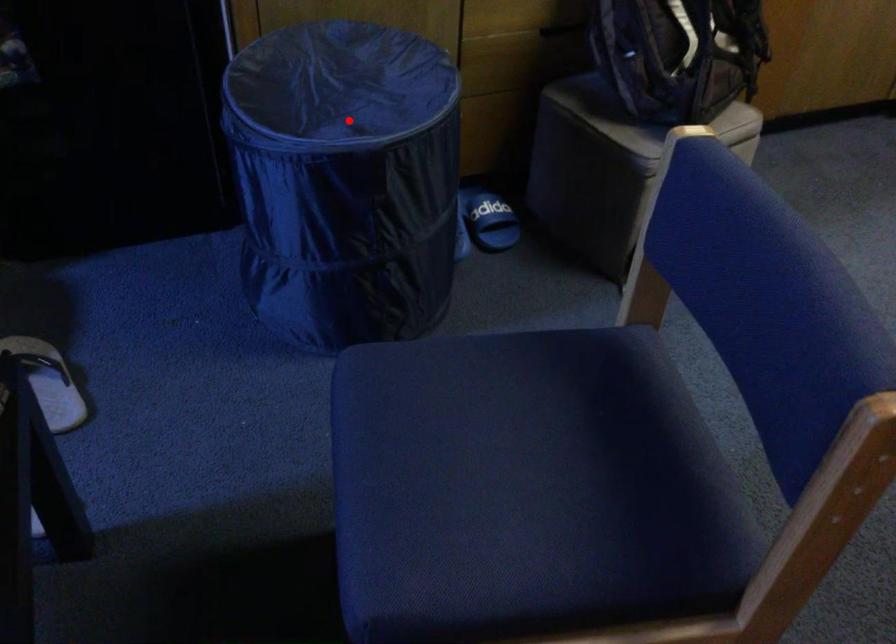
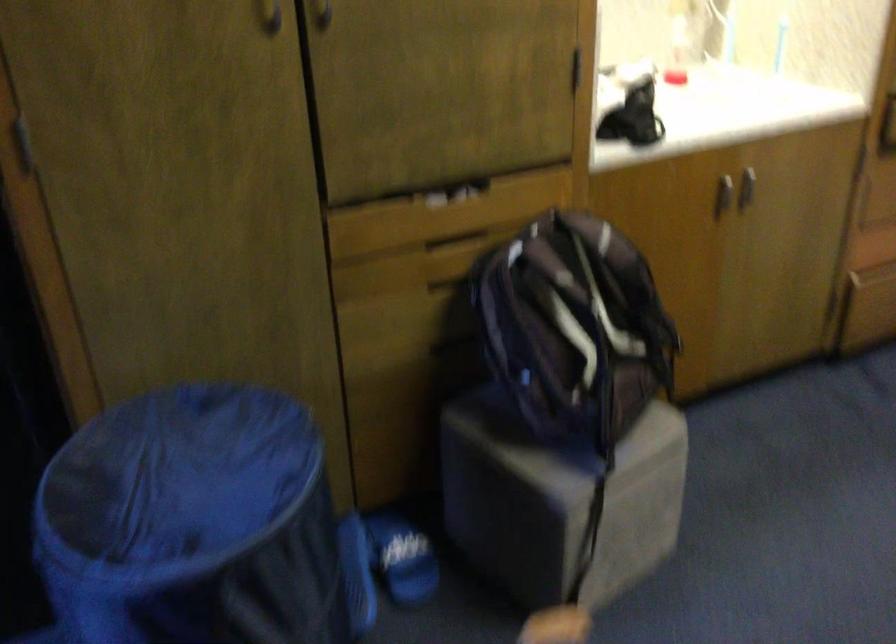
Question: A red point is marked in image1. In image2, is the corresponding 3D point closer to the camera or farther? Reply with the corresponding letter.

Choices:
 (A) The corresponding 3D point is closer.
 (B) The corresponding 3D point is farther.

Answer: (A)